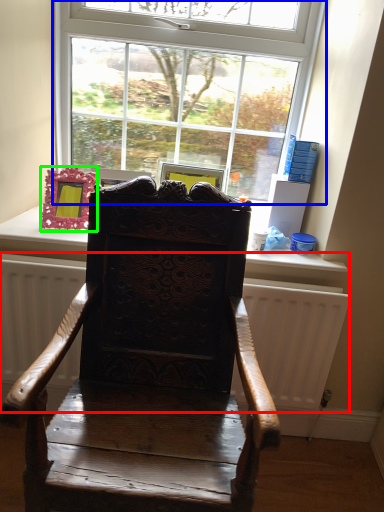
Question: Considering the real-world distances, which object is farthest from radiator (highlighted by a red box)? window (highlighted by a blue box) or picture frame (highlighted by a green box)?

Choices:
 (A) window
 (B) picture frame

Answer: (A)